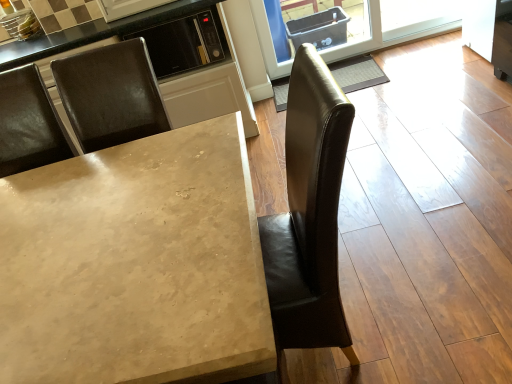
What are the coordinates of `matte beige table at center` in the screenshot? It's located at (136, 265).

This screenshot has height=384, width=512. What do you see at coordinates (136, 265) in the screenshot?
I see `matte beige table at center` at bounding box center [136, 265].

You are a GUI agent. You are given a task and a screenshot of the screen. Output one action in this format:
    pyautogui.click(x=<x>, y=<y>)
    Task: Click on the matte beige table at center
    This screenshot has width=512, height=384.
    Given the screenshot: What is the action you would take?
    pyautogui.click(x=136, y=265)